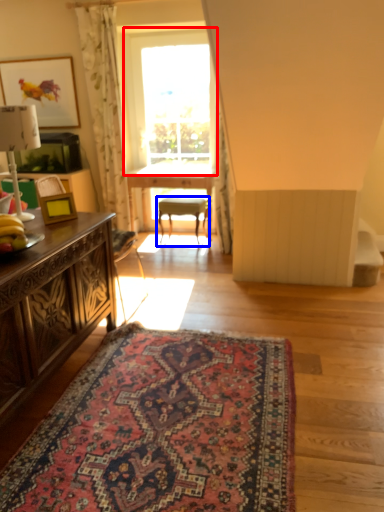
Question: Which point is closer to the camera, window (highlighted by a red box) or chair (highlighted by a blue box)?

Choices:
 (A) window
 (B) chair

Answer: (A)